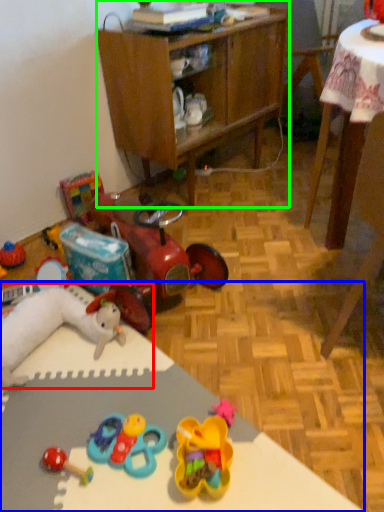
Question: Which is farther away from toy (highlighted by a red box)? desk (highlighted by a blue box) or cabinetry (highlighted by a green box)?

Choices:
 (A) desk
 (B) cabinetry

Answer: (B)